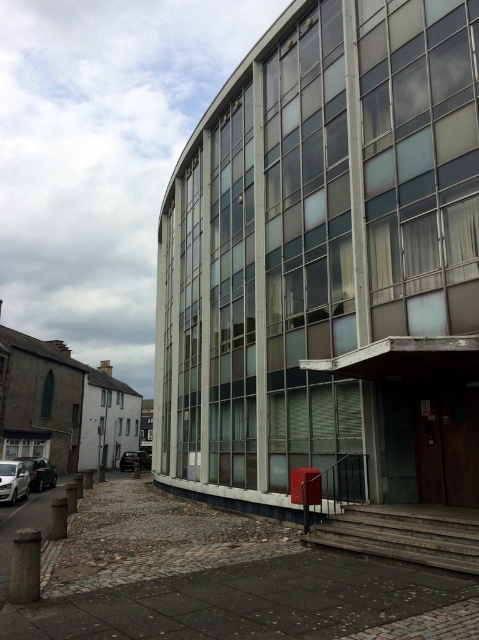
Which is behind, point (21, 484) or point (23, 456)?

The point (23, 456) is more distant.

Does white glossy car at lower left have a larger size compared to shiny black car at lower left?

Incorrect, white glossy car at lower left is not larger than shiny black car at lower left.

Is point (27, 474) positioned behind point (31, 460)?

No, (27, 474) is in front of (31, 460).

At what (x,y) coordinates should I click in order to perform the action: click on white glossy car at lower left. Please return your answer as a coordinate pair (x, y). Looking at the image, I should click on (13, 481).

Who is more forward, (0, 476) or (136, 451)?

Point (0, 476)

Who is more distant from viewer, [24,468] or [149,467]?

The point [149,467] is more distant.

Describe the element at coordinates (13, 481) in the screenshot. I see `white glossy car at lower left` at that location.

Locate an element on the screen. white glossy car at lower left is located at coordinates (13, 481).

Can you confirm if shiny black car at lower left is wider than black matte car at lower left?

Correct, the width of shiny black car at lower left exceeds that of black matte car at lower left.

Is shiny black car at lower left smaller than black matte car at lower left?

Actually, shiny black car at lower left might be larger than black matte car at lower left.

Does point (29, 461) lie behind point (137, 451)?

That is False.

Where is `shiny black car at lower left`? The width and height of the screenshot is (479, 640). shiny black car at lower left is located at coordinates (40, 472).